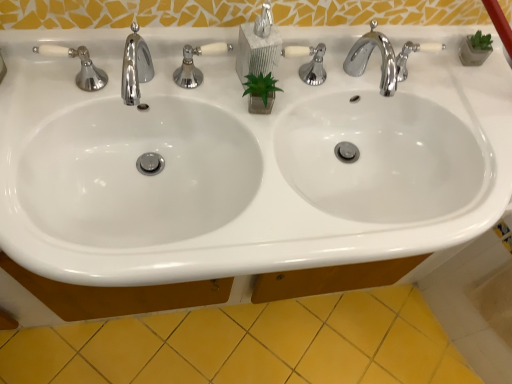
Question: Are matte gray soap dispenser at center and yellow ceramic tile at lower center beside each other?

Choices:
 (A) yes
 (B) no

Answer: (B)

Question: From a real-world perspective, is matte gray soap dispenser at center on top of yellow ceramic tile at lower center?

Choices:
 (A) yes
 (B) no

Answer: (A)

Question: Is matte gray soap dispenser at center oriented away from yellow ceramic tile at lower center?

Choices:
 (A) yes
 (B) no

Answer: (B)

Question: Is matte gray soap dispenser at center located outside yellow ceramic tile at lower center?

Choices:
 (A) no
 (B) yes

Answer: (B)

Question: Does matte gray soap dispenser at center have a greater width compared to yellow ceramic tile at lower center?

Choices:
 (A) yes
 (B) no

Answer: (B)

Question: Does matte gray soap dispenser at center have a lesser width compared to yellow ceramic tile at lower center?

Choices:
 (A) yes
 (B) no

Answer: (A)

Question: Is polished chrome faucet at upper right, arranged as the first tap when viewed from the right, in front of white glossy sink at center?

Choices:
 (A) no
 (B) yes

Answer: (A)

Question: Is polished chrome faucet at upper right, arranged as the first tap when viewed from the right, smaller than white glossy sink at center?

Choices:
 (A) no
 (B) yes

Answer: (B)

Question: Is white glossy sink at center inside polished chrome faucet at upper right, acting as the second tap starting from the left?

Choices:
 (A) yes
 (B) no

Answer: (B)

Question: Is polished chrome faucet at upper right, acting as the second tap starting from the left, at the left side of white glossy sink at center?

Choices:
 (A) yes
 (B) no

Answer: (B)

Question: Is polished chrome faucet at upper right, acting as the second tap starting from the left, far away from white glossy sink at center?

Choices:
 (A) no
 (B) yes

Answer: (A)

Question: Is polished chrome faucet at upper right, acting as the second tap starting from the left, at the right side of white glossy sink at center?

Choices:
 (A) no
 (B) yes

Answer: (B)

Question: Is white glossy sink at center behind polished chrome faucet at upper left, the 1th tap positioned from the left?

Choices:
 (A) yes
 (B) no

Answer: (B)